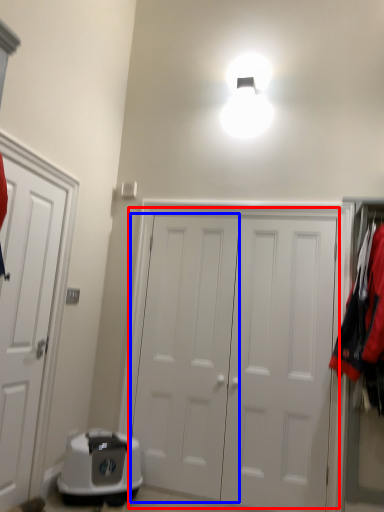
Question: Which point is closer to the camera, door (highlighted by a red box) or door (highlighted by a blue box)?

Choices:
 (A) door
 (B) door

Answer: (A)